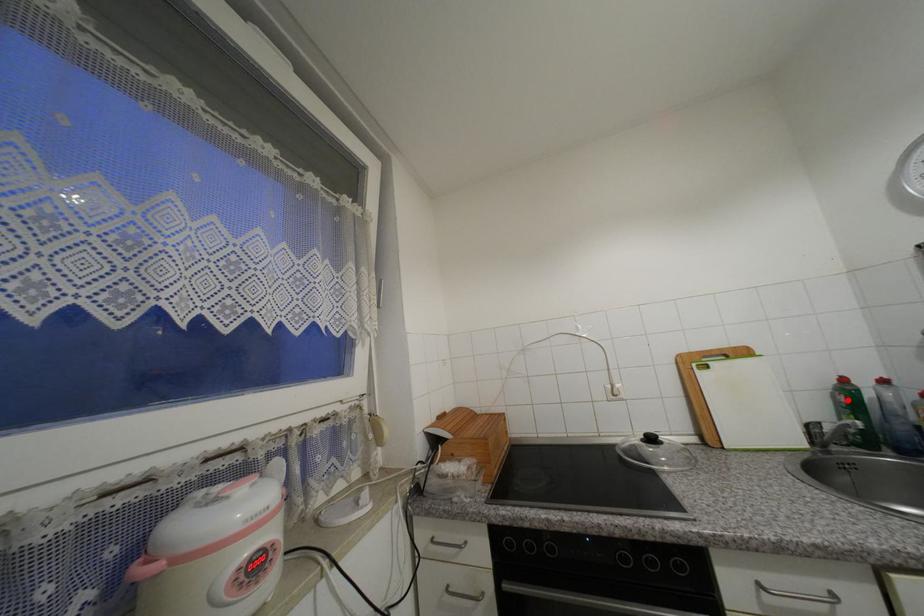
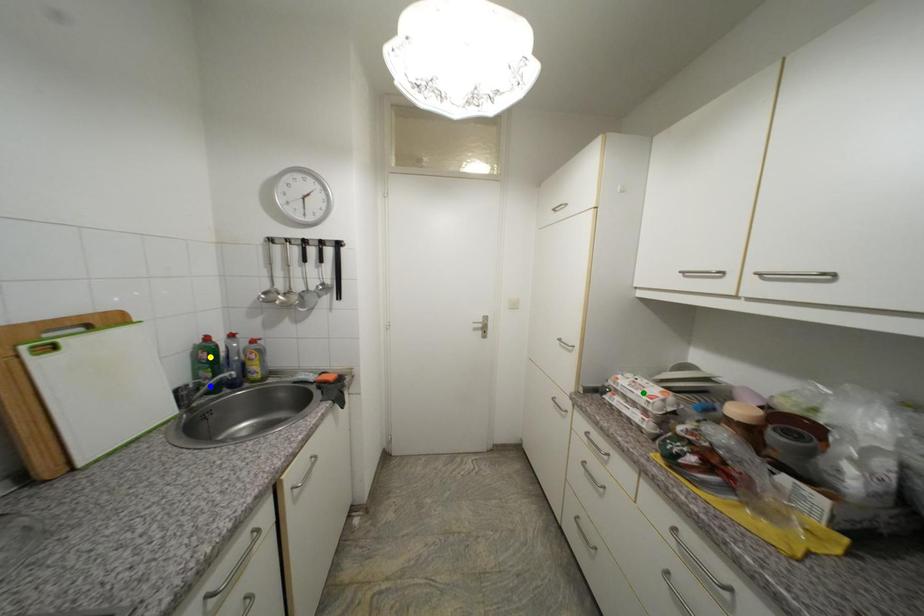
Question: I am providing you with two images of the same scene from different viewpoints. A red point is marked on the first image. You are given multiple points on the second image. Which point in image 2 is actually the same real-world point as the red point in image 1?

Choices:
 (A) blue point
 (B) green point
 (C) yellow point

Answer: (C)